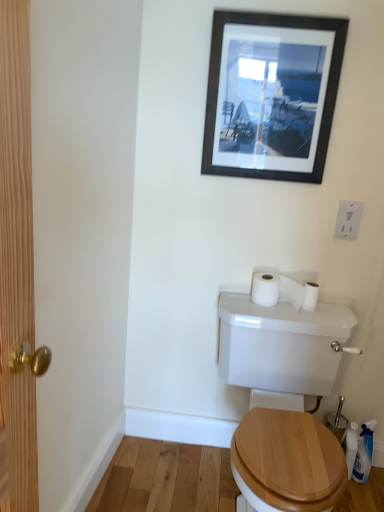
Locate an element on the screen. Image resolution: width=384 pixels, height=512 pixels. vacant space to the right of white matte toilet paper at upper right, the first toilet paper from the left is located at coordinates (327, 315).